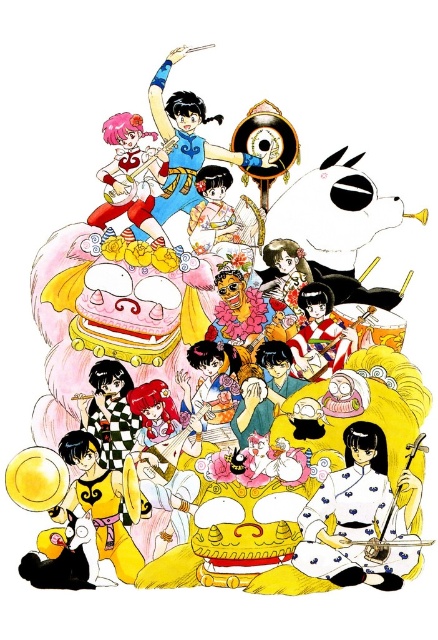
Between point (366, 506) and point (142, 148), which one is positioned in front?

Point (366, 506) is in front.

Is white matte kimono at center further to the viewer compared to matte white dress at upper left?

No.

Describe the element at coordinates (357, 516) in the screenshot. I see `white matte kimono at center` at that location.

Image resolution: width=438 pixels, height=640 pixels. I want to click on white matte kimono at center, so click(x=357, y=516).

Is point (99, 483) in front of point (102, 177)?

Yes, point (99, 483) is closer to viewer.

Does point (120, 531) lie behind point (110, 173)?

No, (120, 531) is closer to viewer.

Identify the location of matte yellow kimono at lower left. (102, 500).

Does matte white dress at upper left have a smaller size compared to matte pink kimono at center?

No.

Describe the element at coordinates (131, 176) in the screenshot. I see `matte white dress at upper left` at that location.

Identify the location of matte white dress at upper left. (131, 176).